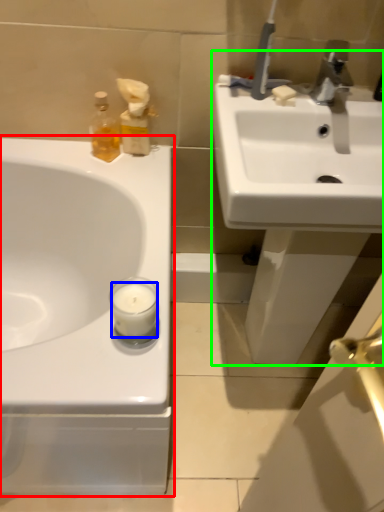
Question: Estimate the real-world distances between objects in this image. Which object is closer to sink (highlighted by a red box), candle (highlighted by a blue box) or sink (highlighted by a green box)?

Choices:
 (A) candle
 (B) sink

Answer: (A)